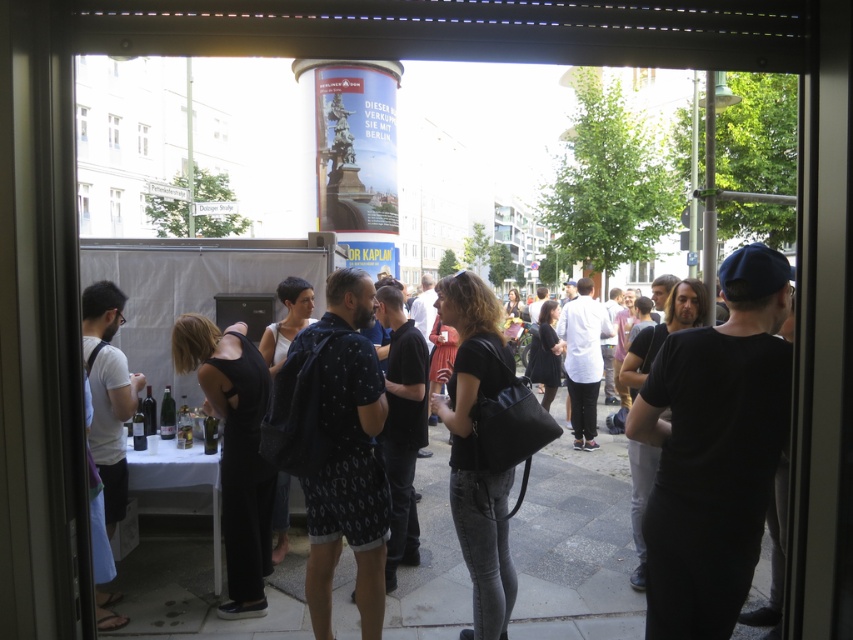
From the picture: You are standing outside and looking through the glass door. You see the smooth concrete pavement at center and the black matte jumpsuit at lower left. Which object is positioned to the right of the other?

The smooth concrete pavement at center is to the right of the black matte jumpsuit at lower left.

You are looking through a glass door at a gathering. You notice two people wearing black clothing. One has a black matte shirt at center and another has a black matte jumpsuit at lower left. Which one is closer to you?

The black matte shirt at center is closer to you because it is positioned over the black matte jumpsuit at lower left.